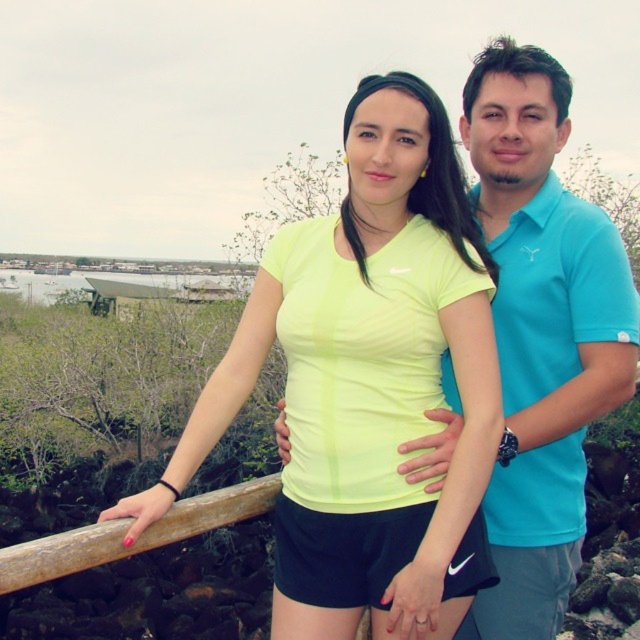
Question: Which object is positioned closest to the matte blue polo shirt at center?

Choices:
 (A) neon yellow fabric at center
 (B) wooden at left

Answer: (A)

Question: Observing the image, what is the correct spatial positioning of neon yellow fabric at center in reference to matte blue polo shirt at center?

Choices:
 (A) right
 (B) left

Answer: (B)

Question: Among these points, which one is farthest from the camera?

Choices:
 (A) (273, 296)
 (B) (556, 211)

Answer: (B)

Question: Which object appears farthest from the camera in this image?

Choices:
 (A) wooden at left
 (B) matte blue polo shirt at center
 (C) neon yellow fabric at center

Answer: (B)

Question: From the image, what is the correct spatial relationship of matte blue polo shirt at center in relation to wooden at left?

Choices:
 (A) below
 (B) above

Answer: (B)

Question: Does neon yellow fabric at center appear on the right side of wooden at left?

Choices:
 (A) no
 (B) yes

Answer: (B)